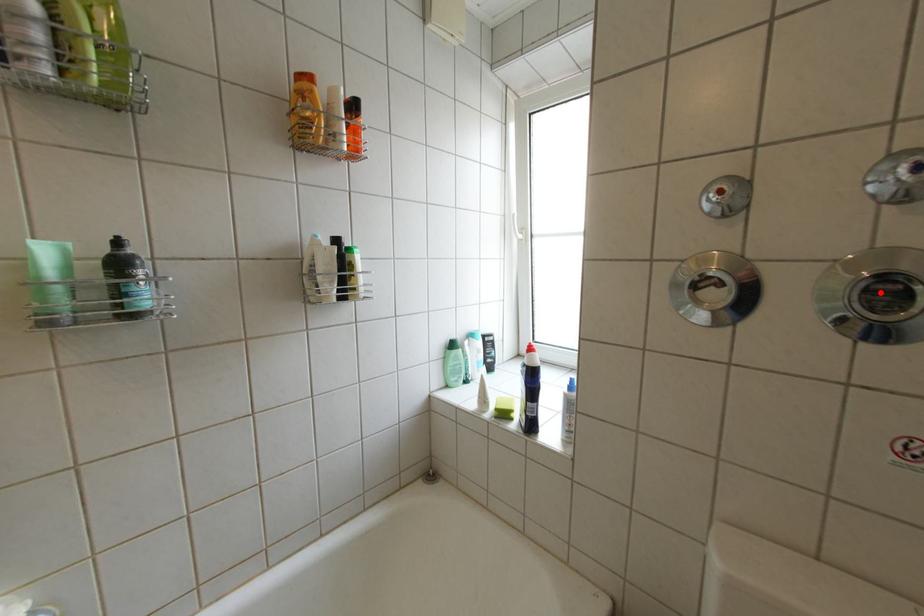
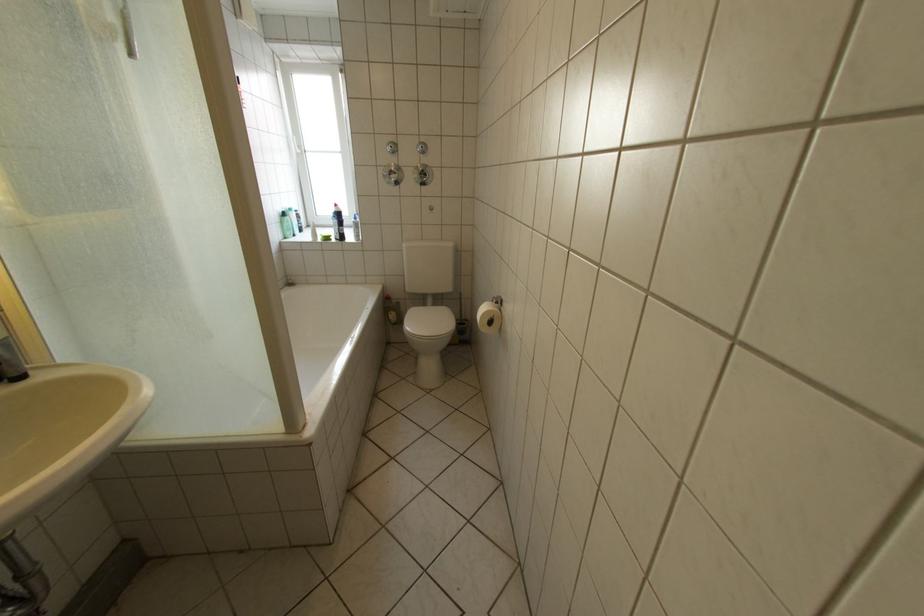
The point at the highlighted location is marked in the first image. Where is the corresponding point in the second image?

(432, 175)